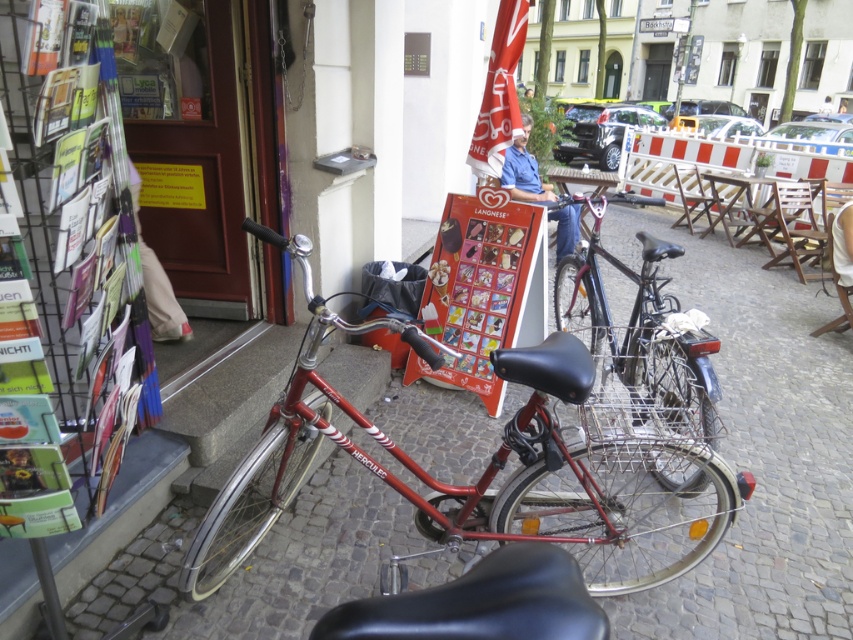
You are a delivery person who needs to choose between two bicycles to deliver packages. The shiny red bicycle at center and the shiny metallic bicycle at center are available. Which bicycle should you choose to ensure it can fit through narrow alleyways between buildings?

The shiny metallic bicycle at center has a smaller width than the shiny red bicycle at center, so it would be more suitable for fitting through narrow alleyways between buildings.